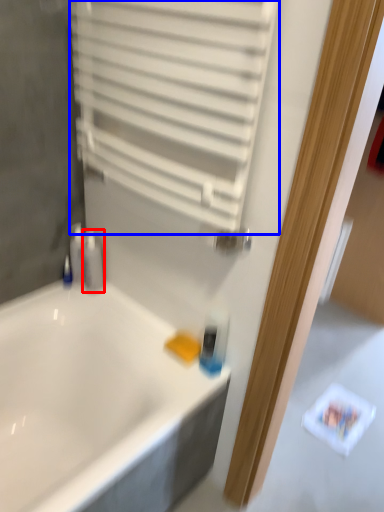
Question: Which object is further to the camera taking this photo, toiletry (highlighted by a red box) or shutter (highlighted by a blue box)?

Choices:
 (A) toiletry
 (B) shutter

Answer: (A)